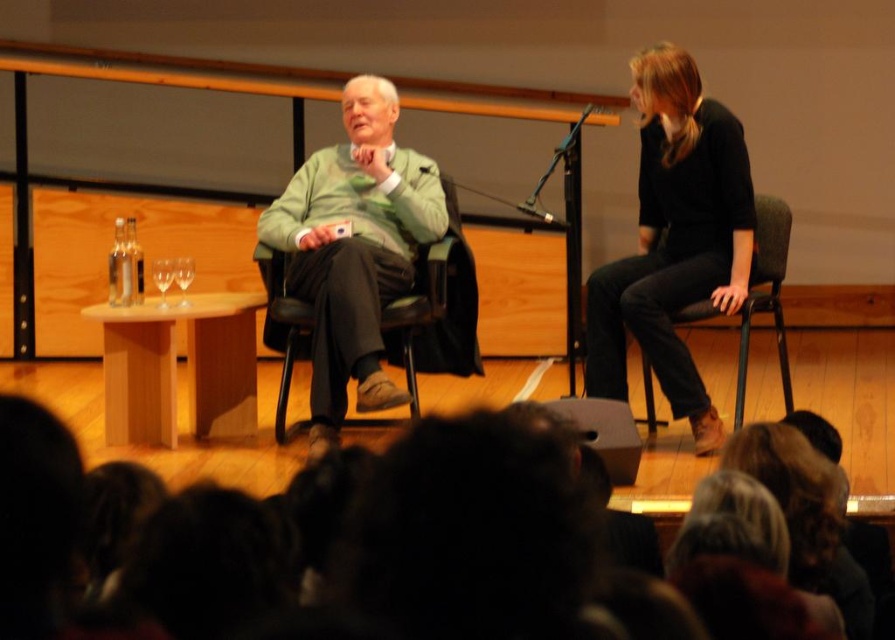
You are a waiter at the event and need to place a new wine glass at the point labeled point (183, 276). Where exactly should you put it?

You should place the new wine glass at the clear glass wine glass at center because point (183, 276) is on clear glass wine glass at center.

You are a photographer setting up for the event. You need to adjust the camera angle so that both the black matte dress at right and the black matte microphone at upper center are in focus. Which object should you focus on first to ensure both are sharp?

The black matte dress at right is much taller than the black matte microphone at upper center. To ensure both are in focus, you should focus on the black matte dress at right first, as it is farther away, and the depth of field will extend backward to the closer microphone.